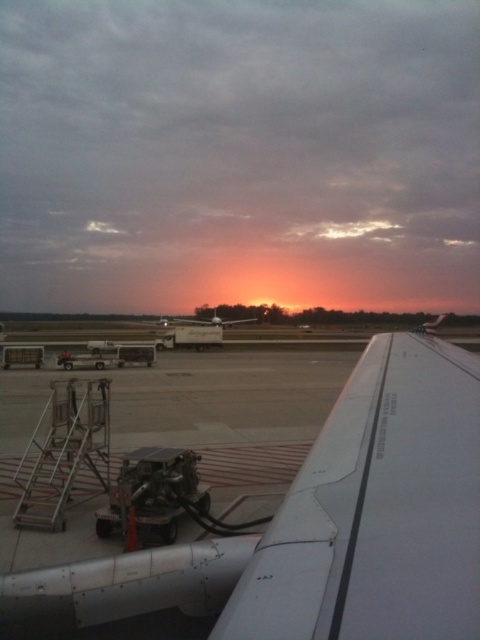
Does white matte wing at upper right appear on the right side of metallic silver ladder at lower left?

Yes, white matte wing at upper right is to the right of metallic silver ladder at lower left.

Image resolution: width=480 pixels, height=640 pixels. Find the location of `white matte wing at upper right`. white matte wing at upper right is located at coordinates (377, 509).

You are a GUI agent. You are given a task and a screenshot of the screen. Output one action in this format:
    pyautogui.click(x=<x>, y=<y>)
    Task: Click on the white matte wing at upper right
    
    Given the screenshot: What is the action you would take?
    pyautogui.click(x=377, y=509)

Describe the element at coordinates (377, 509) in the screenshot. This screenshot has width=480, height=640. I see `white matte wing at upper right` at that location.

This screenshot has height=640, width=480. In order to click on white matte wing at upper right in this screenshot , I will do (x=377, y=509).

Which of these two, metallic silver ladder at lower left or white matte airplane at center, stands shorter?

Standing shorter between the two is metallic silver ladder at lower left.

Does metallic silver ladder at lower left appear over white matte airplane at center?

No.

Between point (47, 502) and point (187, 320), which one is positioned behind?

The point (187, 320) is more distant.

Identify the location of metallic silver ladder at lower left. (64, 452).